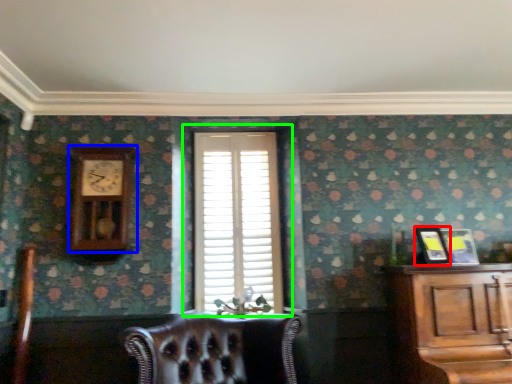
Question: Considering the real-world distances, which object is farthest from picture frame (highlighted by a red box)? clock (highlighted by a blue box) or window (highlighted by a green box)?

Choices:
 (A) clock
 (B) window

Answer: (A)